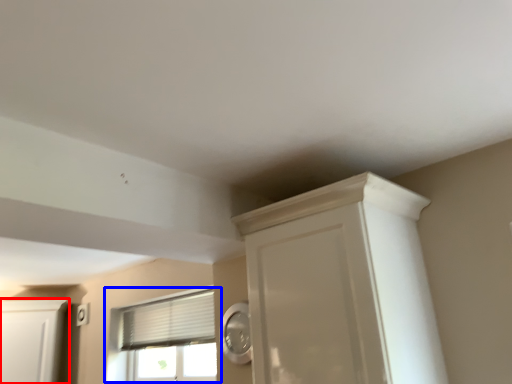
Question: Among these objects, which one is nearest to the camera, cabinetry (highlighted by a red box) or window (highlighted by a blue box)?

Choices:
 (A) cabinetry
 (B) window

Answer: (B)